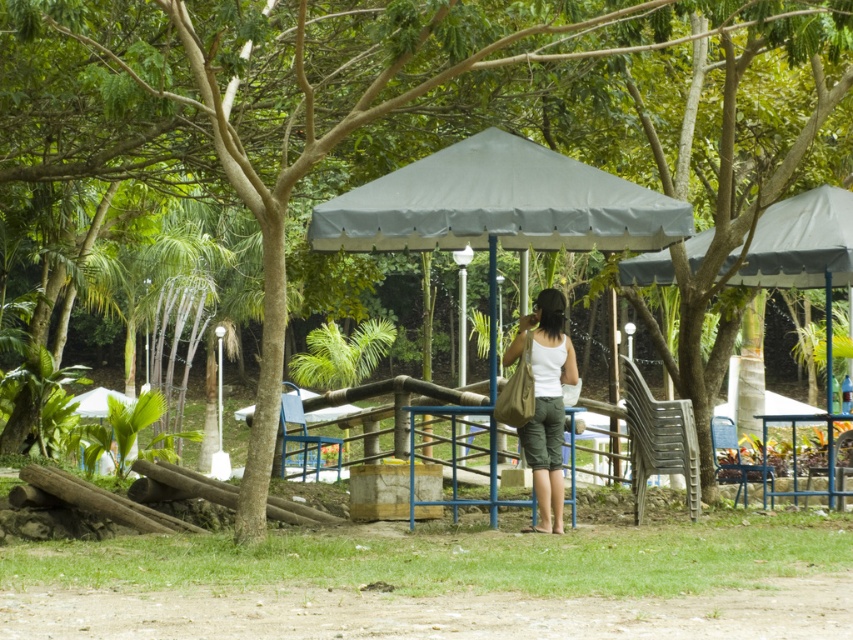
From the picture: You are standing in the park and see two gray fabric canopies. Which one is closer to you, the gray fabric canopy at center or the gray fabric canopy at upper center?

The gray fabric canopy at center is closer to the viewer than the gray fabric canopy at upper center.

You are planning to set up a picnic in the park. You have two gray fabric canopies available. The gray fabric canopy at center and the gray fabric canopy at upper center. Which one should you choose if you want a larger shaded area?

The gray fabric canopy at center has a larger width than the gray fabric canopy at upper center, so it provides a bigger shaded area. You should choose the gray fabric canopy at center.